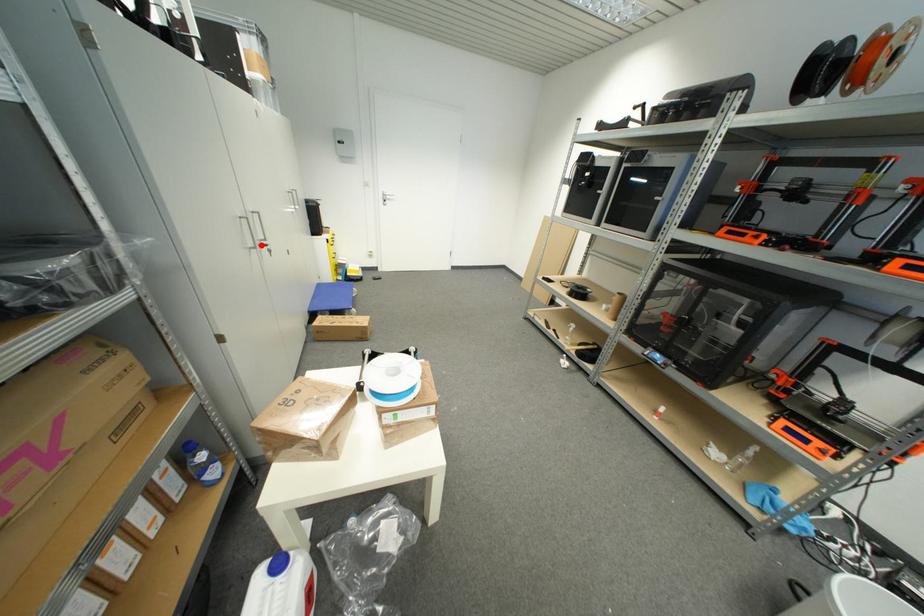
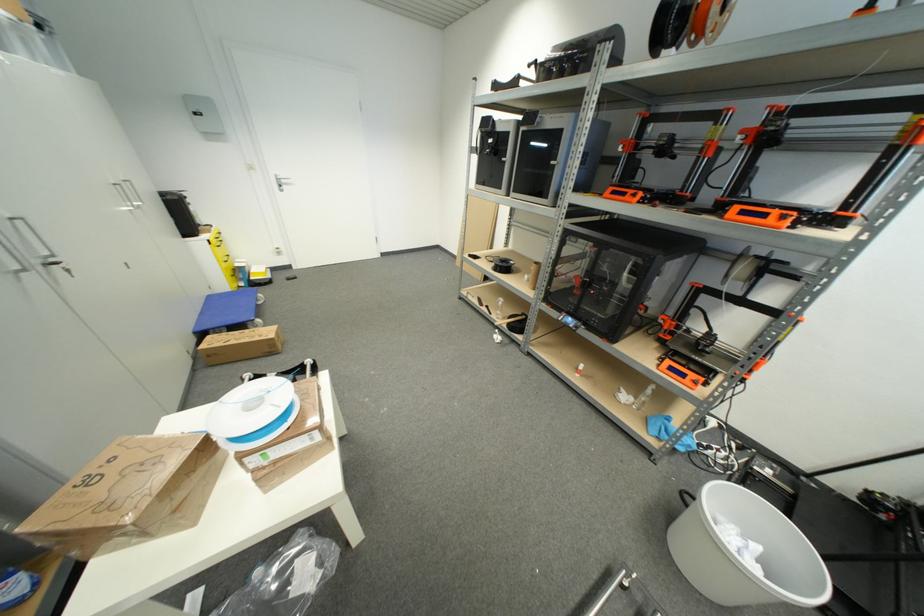
Question: I am providing you with two images of the same scene from different viewpoints. A red point is shown in image1. For the corresponding object point in image2, is it positioned nearer or farther from the camera?

Choices:
 (A) Nearer
 (B) Farther

Answer: (B)